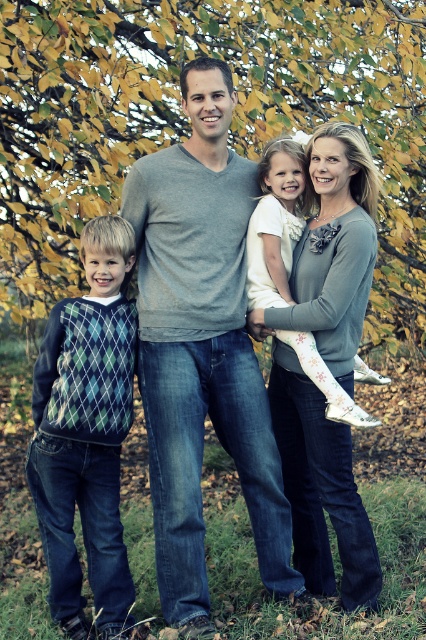
Question: Which object is the closest to the white textured sweater at center?

Choices:
 (A) yellow-green leaves at upper center
 (B) green argyle sweater at left

Answer: (B)

Question: From the image, what is the correct spatial relationship of gray matte sweater at center in relation to white textured sweater at center?

Choices:
 (A) below
 (B) above

Answer: (B)

Question: Is yellow-green leaves at upper center thinner than white textured sweater at center?

Choices:
 (A) yes
 (B) no

Answer: (B)

Question: Among these objects, which one is farthest from the camera?

Choices:
 (A) gray matte sweater at center
 (B) yellow-green leaves at upper center
 (C) green argyle sweater at left
 (D) white textured sweater at center

Answer: (B)

Question: Considering the real-world distances, which object is farthest from the yellow-green leaves at upper center?

Choices:
 (A) green argyle sweater at left
 (B) white textured sweater at center

Answer: (B)

Question: Does gray matte sweater at center come in front of green argyle sweater at left?

Choices:
 (A) no
 (B) yes

Answer: (B)